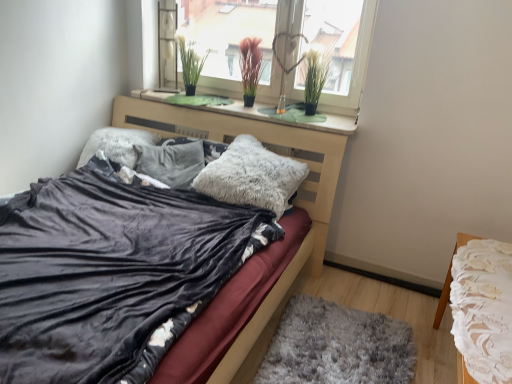
Question: Could you tell me if fuzzy white pillow at center, the second pillow viewed from the right, is turned towards velvet black bed at center?

Choices:
 (A) no
 (B) yes

Answer: (B)

Question: Is fuzzy white pillow at center, which ranks as the 2th pillow in left-to-right order, to the right of velvet black bed at center from the viewer's perspective?

Choices:
 (A) no
 (B) yes

Answer: (B)

Question: Is there a large distance between fuzzy white pillow at center, which ranks as the 2th pillow in left-to-right order, and velvet black bed at center?

Choices:
 (A) no
 (B) yes

Answer: (A)

Question: Does fuzzy white pillow at center, the second pillow viewed from the right, have a greater height compared to velvet black bed at center?

Choices:
 (A) no
 (B) yes

Answer: (B)

Question: Does fuzzy white pillow at center, which ranks as the 2th pillow in left-to-right order, have a lesser width compared to velvet black bed at center?

Choices:
 (A) yes
 (B) no

Answer: (A)

Question: Relative to purple matte plant at center, which is the second plant in left-to-right order, is green grass-like plant at upper center, acting as the 3th plant starting from the right, in front or behind?

Choices:
 (A) behind
 (B) front

Answer: (A)

Question: From a real-world perspective, relative to purple matte plant at center, positioned as the second plant in right-to-left order, is green grass-like plant at upper center, acting as the 3th plant starting from the right, vertically above or below?

Choices:
 (A) above
 (B) below

Answer: (A)

Question: Considering the relative positions of green grass-like plant at upper center, which is the first plant in left-to-right order, and purple matte plant at center, positioned as the second plant in right-to-left order, in the image provided, is green grass-like plant at upper center, which is the first plant in left-to-right order, to the left or to the right of purple matte plant at center, positioned as the second plant in right-to-left order,?

Choices:
 (A) left
 (B) right

Answer: (A)

Question: Which is correct: green grass-like plant at upper center, which is the first plant in left-to-right order, is inside purple matte plant at center, which is the second plant in left-to-right order, or outside of it?

Choices:
 (A) inside
 (B) outside

Answer: (B)

Question: From the image's perspective, is fuzzy white pillow at center, the second pillow viewed from the right, above or below green grass-like plant at upper center, which is the first plant in left-to-right order?

Choices:
 (A) above
 (B) below

Answer: (B)

Question: Considering their positions, is fuzzy white pillow at center, the second pillow viewed from the right, located in front of or behind green grass-like plant at upper center, which is the first plant in left-to-right order?

Choices:
 (A) front
 (B) behind

Answer: (A)

Question: In terms of height, does fuzzy white pillow at center, the second pillow viewed from the right, look taller or shorter compared to green grass-like plant at upper center, acting as the 3th plant starting from the right?

Choices:
 (A) short
 (B) tall

Answer: (A)

Question: From a real-world perspective, is fuzzy white pillow at center, which ranks as the 2th pillow in left-to-right order, physically located above or below green grass-like plant at upper center, acting as the 3th plant starting from the right?

Choices:
 (A) below
 (B) above

Answer: (A)

Question: Is transparent glass window at upper center taller or shorter than green grass-like plant at upper center, which is the first plant in left-to-right order?

Choices:
 (A) short
 (B) tall

Answer: (B)

Question: From a real-world perspective, is transparent glass window at upper center physically located above or below green grass-like plant at upper center, which is the first plant in left-to-right order?

Choices:
 (A) above
 (B) below

Answer: (A)